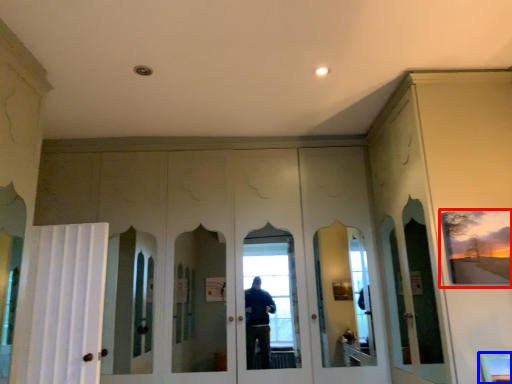
Question: Which object is further to the camera taking this photo, picture frame (highlighted by a red box) or window (highlighted by a blue box)?

Choices:
 (A) picture frame
 (B) window

Answer: (A)